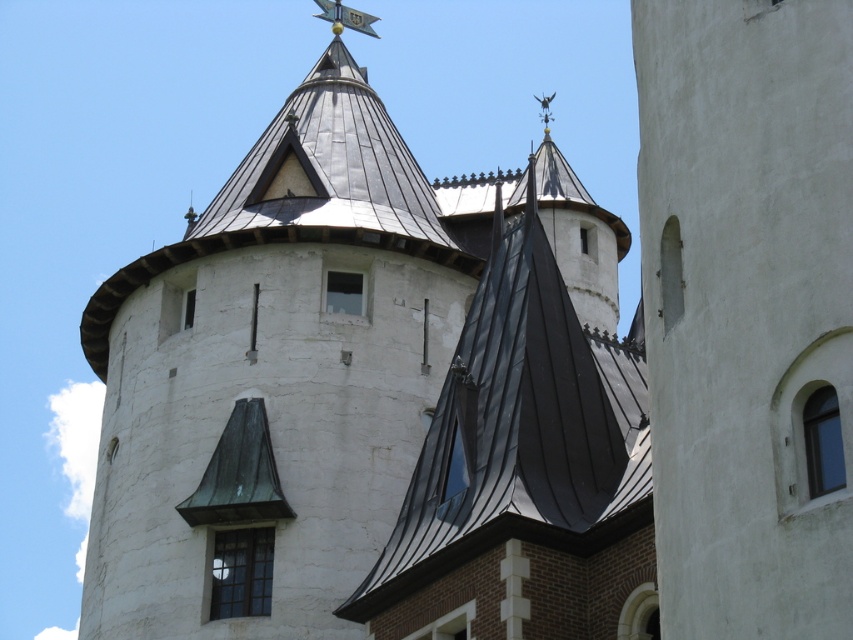
Question: Which point appears closest to the camera in this image?

Choices:
 (A) (706, 342)
 (B) (577, 396)
 (C) (407, 152)

Answer: (A)

Question: Can you confirm if white stone tower at center is positioned to the right of black metal roof at center?

Choices:
 (A) no
 (B) yes

Answer: (A)

Question: Which point is farther to the camera?

Choices:
 (A) (804, 561)
 (B) (508, 483)

Answer: (B)

Question: Does white stone tower at center come in front of white smooth wall at right?

Choices:
 (A) no
 (B) yes

Answer: (A)

Question: Which is nearer to the white smooth wall at right?

Choices:
 (A) white stone tower at center
 (B) black metal roof at center

Answer: (B)

Question: Does white stone tower at center have a larger size compared to white smooth wall at right?

Choices:
 (A) no
 (B) yes

Answer: (B)